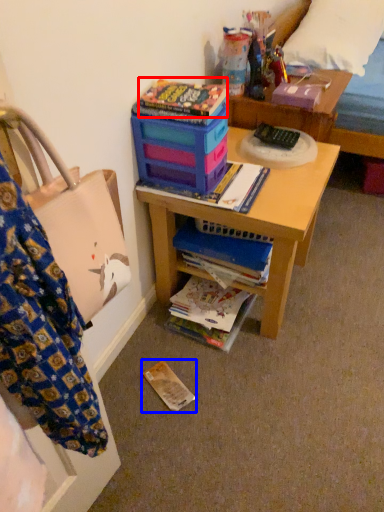
Question: Among these objects, which one is nearest to the camera, paperback book (highlighted by a red box) or paperback book (highlighted by a blue box)?

Choices:
 (A) paperback book
 (B) paperback book

Answer: (A)